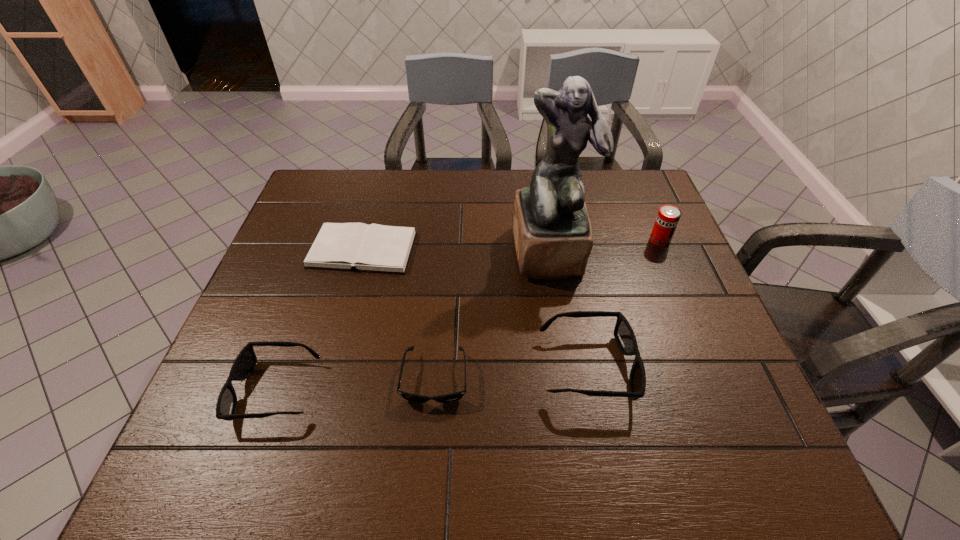
The image size is (960, 540). Identify the location of vacant point located between the can and the second sunglasses from right to left. (547, 309).

Image resolution: width=960 pixels, height=540 pixels. I want to click on vacant region between the shortest sunglasses and the tallest object, so click(x=492, y=315).

Locate an element on the screen. The width and height of the screenshot is (960, 540). vacant area between the sculpture and the fourth shortest object is located at coordinates (569, 309).

Identify the location of free spot between the tallest object and the second tallest sunglasses. (413, 321).

Identify which object is the third nearest to the fifth shortest object. Please provide its 2D coordinates. Your answer should be formatted as a tuple, i.e. [(x, y)], where the tuple contains the x and y coordinates of a point satisfying the conditions above.

[(451, 397)]

The height and width of the screenshot is (540, 960). Identify the location of the fourth closest object to the sculpture. (376, 248).

Locate which sunglasses is the third closest to the hardback book. Please provide its 2D coordinates. Your answer should be formatted as a tuple, i.e. [(x, y)], where the tuple contains the x and y coordinates of a point satisfying the conditions above.

[(624, 335)]

This screenshot has height=540, width=960. I want to click on the closest sunglasses relative to the fourth object from right to left, so click(x=624, y=335).

The height and width of the screenshot is (540, 960). In order to click on free space that satisfies the following two spatial constraints: 1. in a relaxed pose on the tallest object; 2. on the front-facing side of the leftmost sunglasses in this screenshot , I will do `click(573, 390)`.

Find the location of a particular element. free space in the image that satisfies the following two spatial constraints: 1. on the front side of the can; 2. on the front-facing side of the rightmost sunglasses is located at coordinates (713, 367).